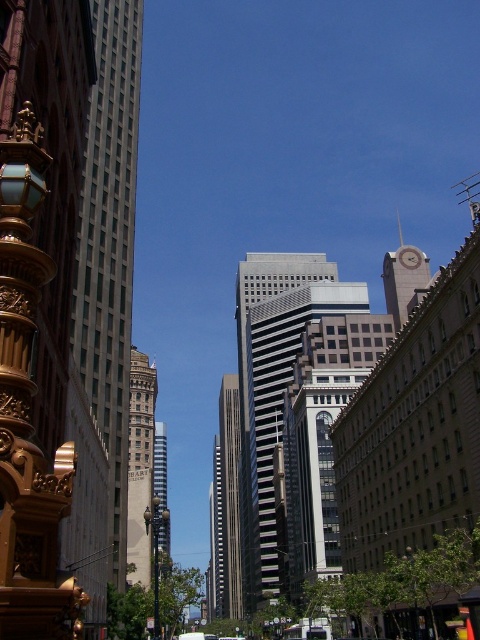
Question: Which object is positioned farthest from the brown textured clock at center?

Choices:
 (A) brown stone tower at center
 (B) gold ornate lamp post at left

Answer: (B)

Question: Is brown stone tower at center closer to the viewer compared to brown textured clock at center?

Choices:
 (A) yes
 (B) no

Answer: (A)

Question: Can you confirm if gold ornate lamp post at left is thinner than brown textured clock at center?

Choices:
 (A) no
 (B) yes

Answer: (A)

Question: Can you confirm if smooth glass skyscraper at center is bigger than gold ornate lamp post at left?

Choices:
 (A) no
 (B) yes

Answer: (B)

Question: Which object is the farthest from the gold ornate lamp post at left?

Choices:
 (A) gray glass skyscraper at left
 (B) brown textured clock at center

Answer: (B)

Question: Which object is farther from the camera taking this photo?

Choices:
 (A) gold textured clock tower at upper right
 (B) brown textured clock at center
 (C) smooth glass skyscraper at center
 (D) gold ornate lamp post at left

Answer: (C)